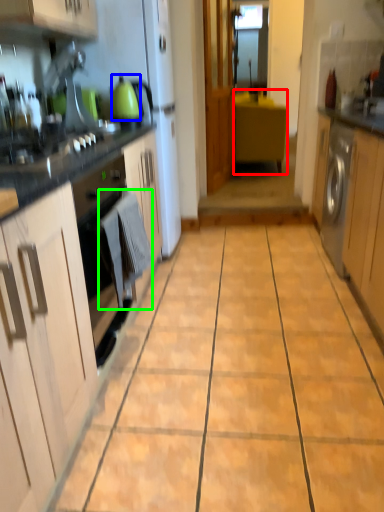
Question: Which object is positioned closest to cabinetry (highlighted by a red box)? Select from kitchen appliance (highlighted by a blue box) and laundry (highlighted by a green box).

Choices:
 (A) kitchen appliance
 (B) laundry

Answer: (A)